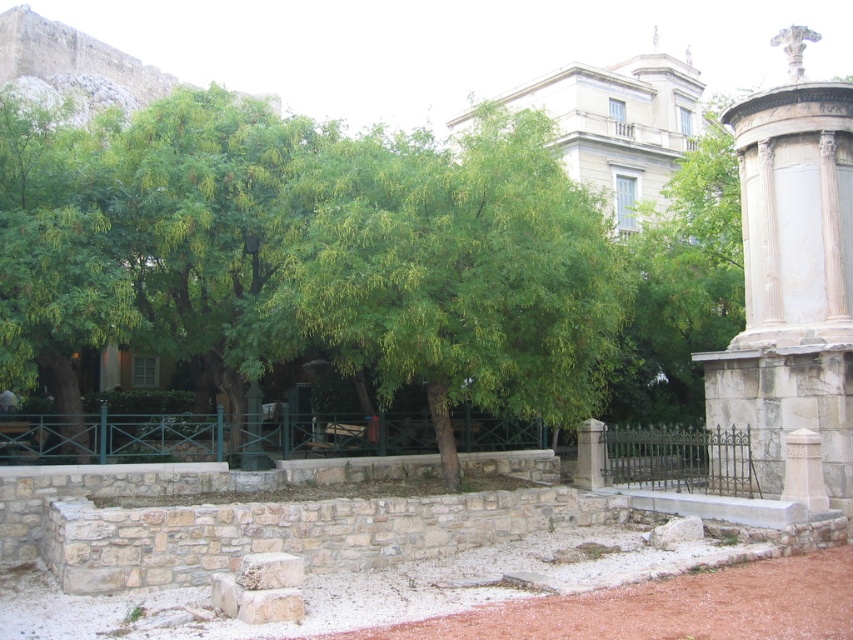
Question: Which object is closer to the camera taking this photo?

Choices:
 (A) white marble column at right
 (B) green leafy tree at left

Answer: (A)

Question: Among these points, which one is nearest to the camera?

Choices:
 (A) (407, 230)
 (B) (45, 362)

Answer: (A)

Question: Estimate the real-world distances between objects in this image. Which object is closer to the white marble column at right?

Choices:
 (A) green leafy tree at center
 (B) green leafy tree at left

Answer: (A)

Question: Does green leafy tree at center come in front of white marble column at right?

Choices:
 (A) yes
 (B) no

Answer: (A)

Question: Is white marble column at right thinner than green leafy tree at left?

Choices:
 (A) yes
 (B) no

Answer: (B)

Question: Does white marble column at right have a greater width compared to green leafy tree at left?

Choices:
 (A) no
 (B) yes

Answer: (B)